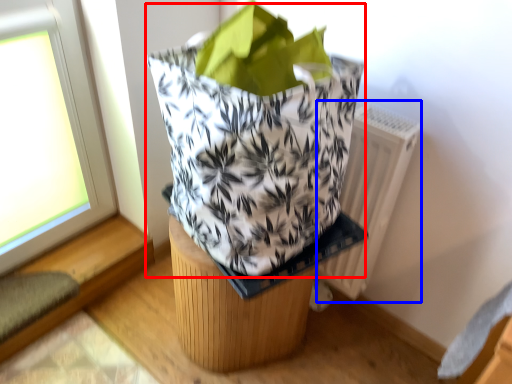
Question: Which object is closer to the camera taking this photo, grocery bag (highlighted by a red box) or radiator (highlighted by a blue box)?

Choices:
 (A) grocery bag
 (B) radiator

Answer: (A)